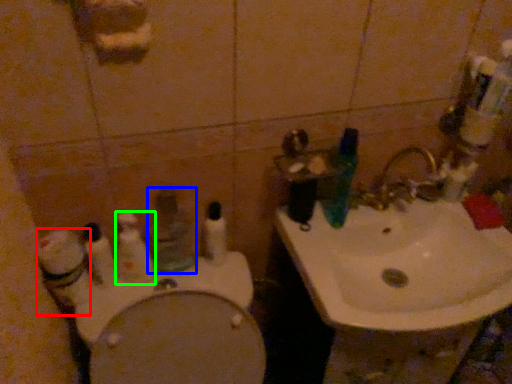
Question: Which is farther away from cleaning product (highlighted by a red box)? mouthwash (highlighted by a blue box) or toothbrush (highlighted by a green box)?

Choices:
 (A) mouthwash
 (B) toothbrush

Answer: (A)